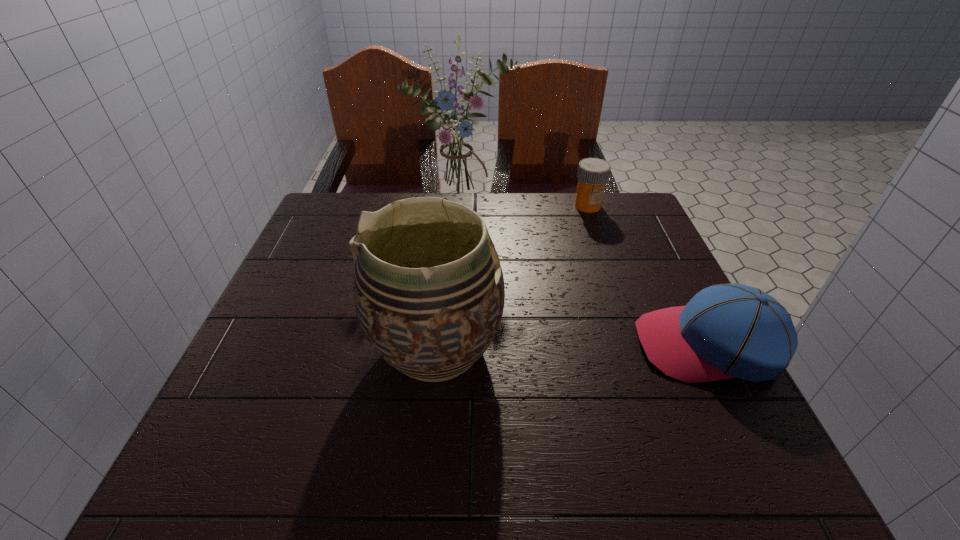
You are a GUI agent. You are given a task and a screenshot of the screen. Output one action in this format:
    pyautogui.click(x=<x>, y=<y>)
    Task: Click on the vacant space that satisfies the following two spatial constraints: 1. on the front side of the medicine; 2. on the front-facing side of the baseball cap
    
    Given the screenshot: What is the action you would take?
    pyautogui.click(x=636, y=345)

At what (x,y) coordinates should I click in order to perform the action: click on vacant area in the image that satisfies the following two spatial constraints: 1. on the back side of the bouquet; 2. on the right side of the medicine. Please return your answer as a coordinate pair (x, y). Looking at the image, I should click on (462, 206).

This screenshot has width=960, height=540. I want to click on vacant region that satisfies the following two spatial constraints: 1. on the back side of the baseball cap; 2. on the front-facing side of the second tallest object, so click(437, 345).

Find the location of a particular element. The width and height of the screenshot is (960, 540). blank area in the image that satisfies the following two spatial constraints: 1. on the back side of the baseball cap; 2. on the front-facing side of the pottery is located at coordinates (437, 345).